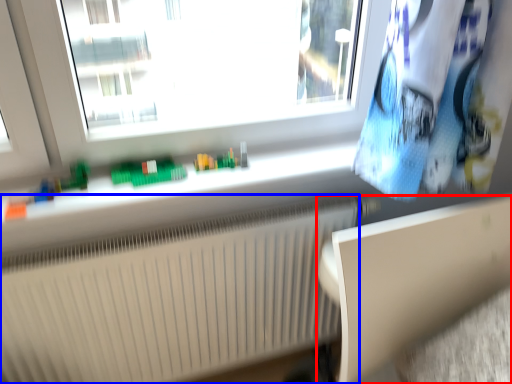
Question: Which of the following is the closest to the observer, table (highlighted by a red box) or radiator (highlighted by a blue box)?

Choices:
 (A) table
 (B) radiator

Answer: (A)